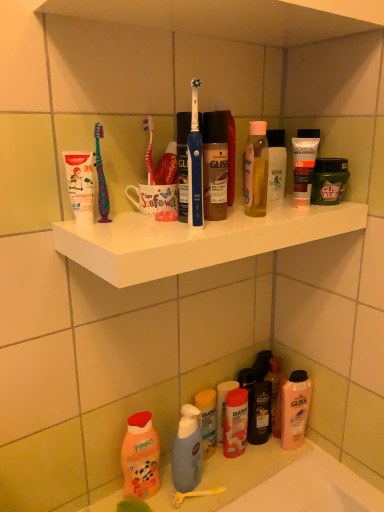
The image size is (384, 512). Find the location of `free space to the right of white matte toothpaste tube at upper left, acting as the 1th toiletry starting from the left`. free space to the right of white matte toothpaste tube at upper left, acting as the 1th toiletry starting from the left is located at coordinates (152, 226).